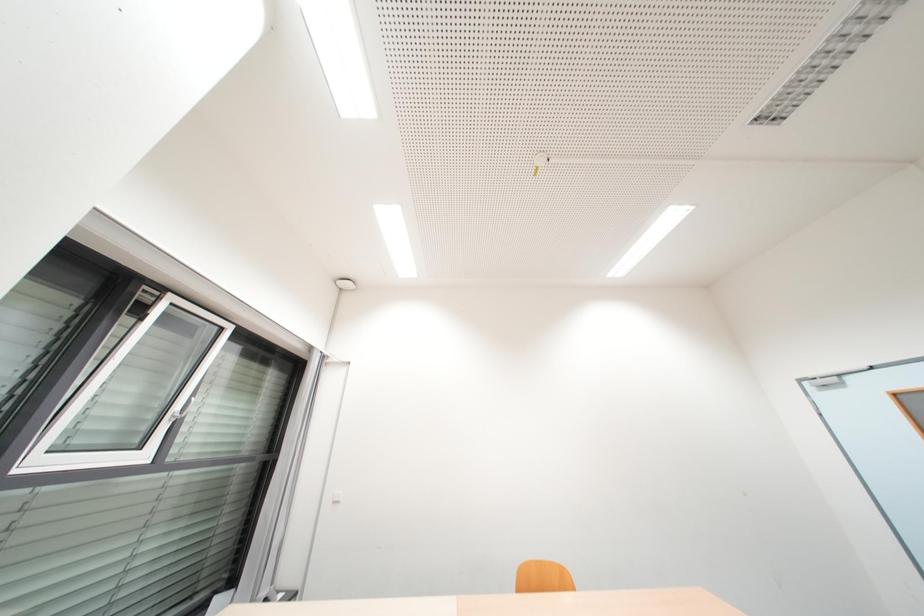
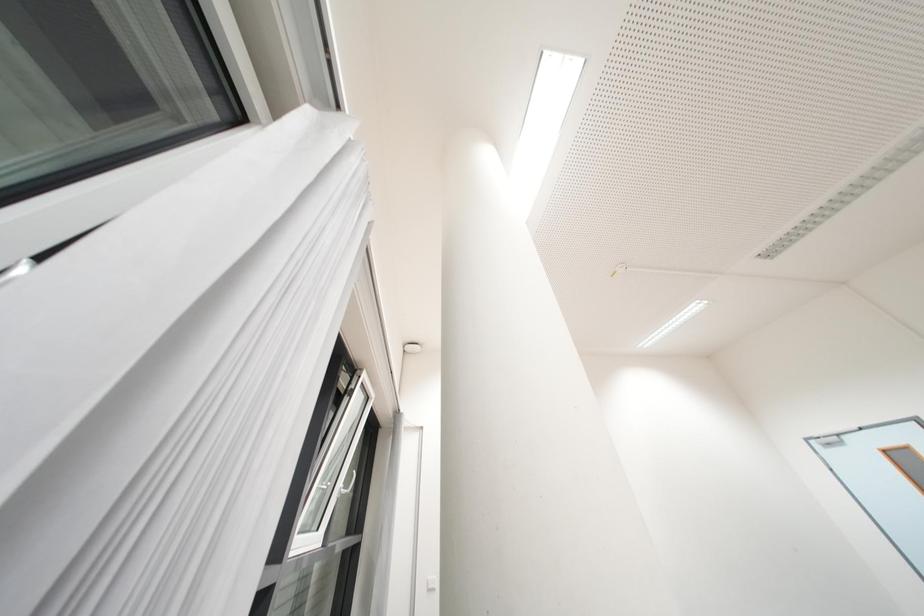
Question: In a continuous first-person perspective shot, in which direction is the camera moving?

Choices:
 (A) Left
 (B) Right
 (C) Forward
 (D) Backward

Answer: (A)